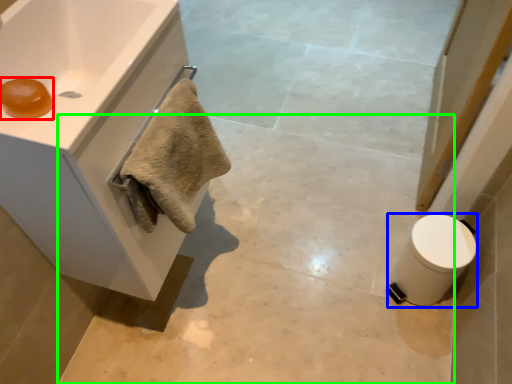
Question: Considering the real-world distances, which object is closest to soap (highlighted by a red box)? toilet bowl (highlighted by a blue box) or concrete (highlighted by a green box).

Choices:
 (A) toilet bowl
 (B) concrete

Answer: (B)